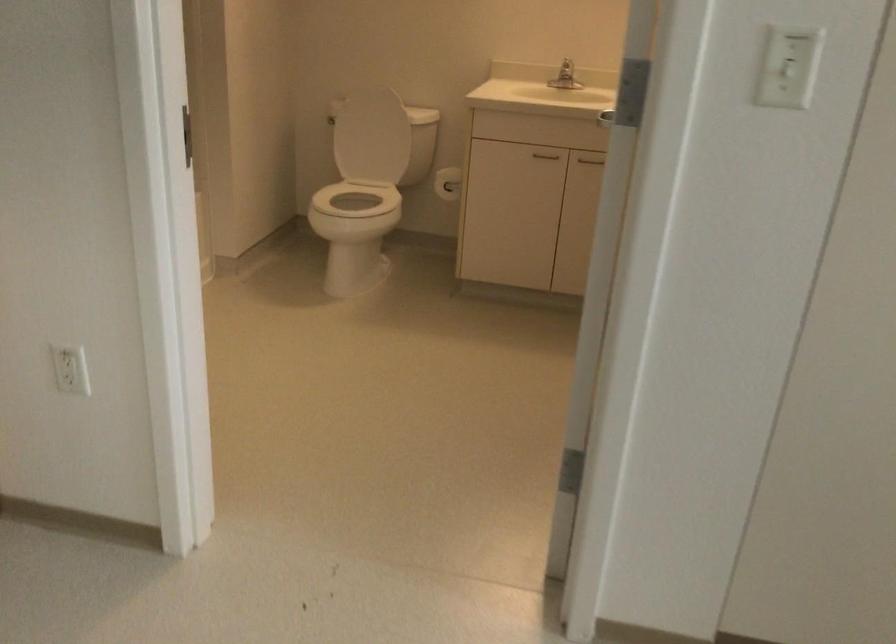
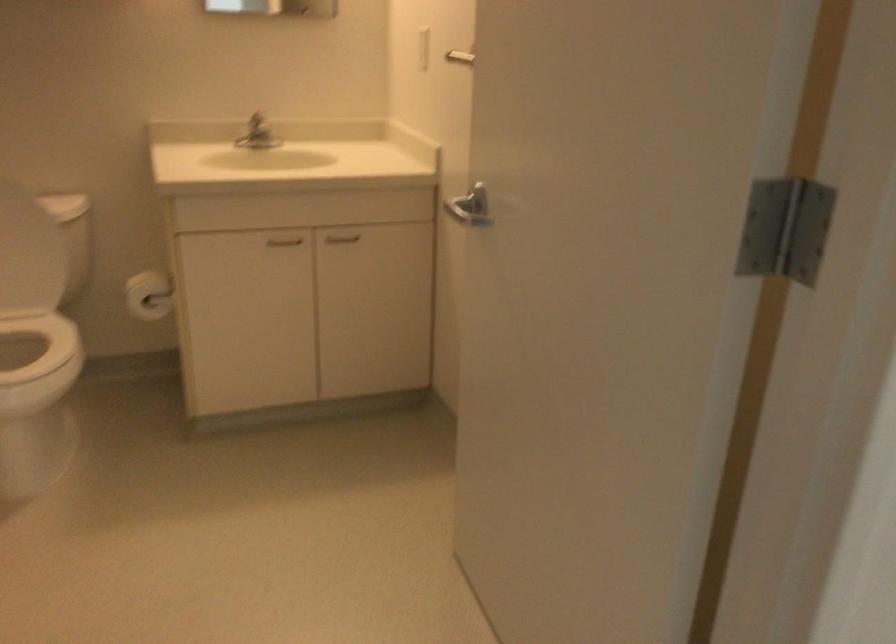
In the second image, find the point that corresponds to point (449, 182) in the first image.

(149, 295)